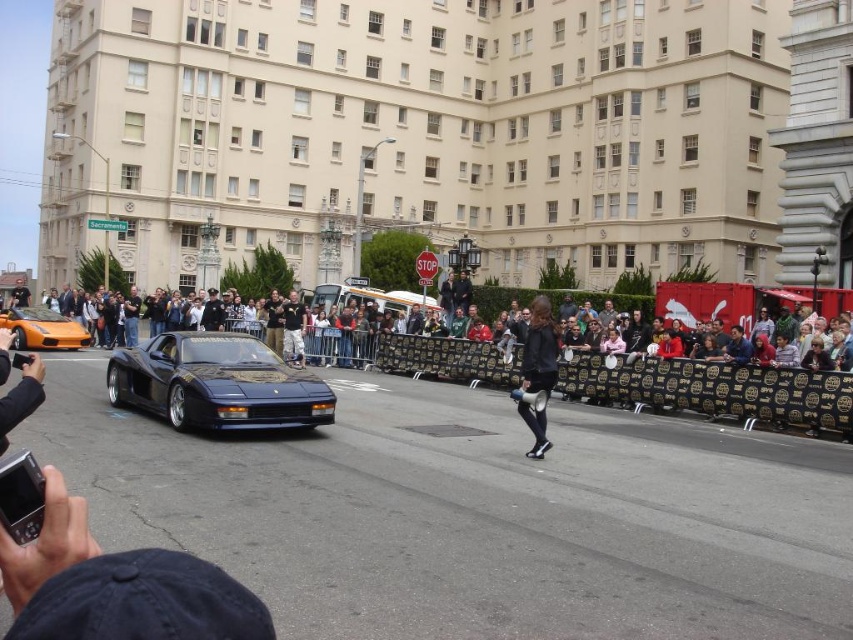
Question: Which object appears closest to the camera in this image?

Choices:
 (A) orange matte sports car at left
 (B) black leather jacket at center
 (C) shiny blue ferrari at center

Answer: (C)

Question: Can you confirm if shiny blue ferrari at center is wider than shiny silver van at center?

Choices:
 (A) yes
 (B) no

Answer: (B)

Question: Which object appears farthest from the camera in this image?

Choices:
 (A) multicolored fabric crowd at center
 (B) black leather jacket at center
 (C) shiny blue ferrari at center
 (D) shiny silver van at center

Answer: (D)

Question: Which object is the closest to the shiny silver van at center?

Choices:
 (A) orange matte sports car at left
 (B) shiny blue ferrari at center
 (C) black leather jacket at center

Answer: (C)

Question: Does shiny blue ferrari at center have a smaller size compared to orange matte sports car at left?

Choices:
 (A) yes
 (B) no

Answer: (A)

Question: Is shiny blue ferrari at center to the right of orange matte sports car at left from the viewer's perspective?

Choices:
 (A) no
 (B) yes

Answer: (B)